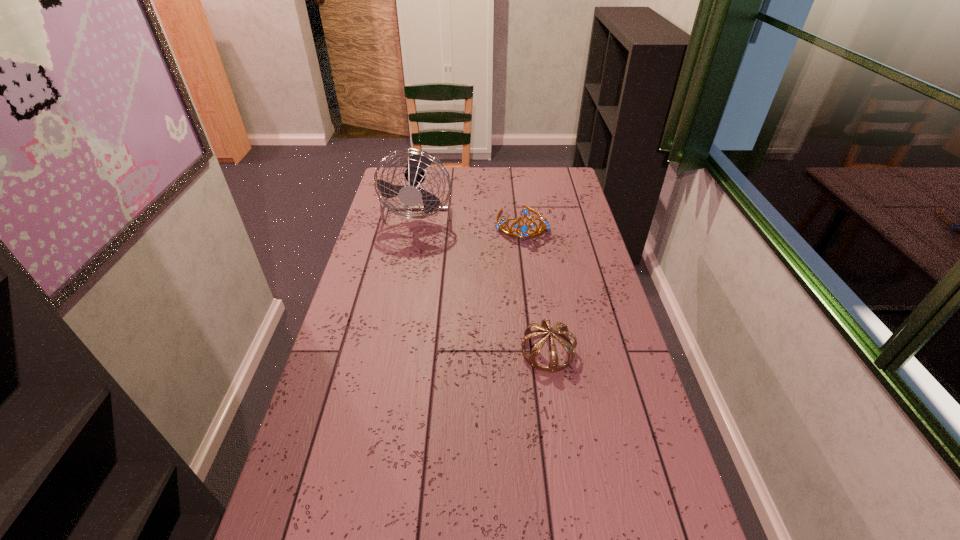
At what (x,y) coordinates should I click in order to perform the action: click on the leftmost object. Please return your answer as a coordinate pair (x, y). The image size is (960, 540). Looking at the image, I should click on (411, 195).

Image resolution: width=960 pixels, height=540 pixels. I want to click on the tallest object, so click(x=411, y=195).

Find the location of `the farther tiara`. the farther tiara is located at coordinates (523, 229).

At what (x,y) coordinates should I click in order to perform the action: click on the second tallest object. Please return your answer as a coordinate pair (x, y). This screenshot has height=540, width=960. Looking at the image, I should click on (523, 229).

Locate an element on the screen. The width and height of the screenshot is (960, 540). the shorter tiara is located at coordinates (545, 327).

This screenshot has height=540, width=960. Identify the location of the nearer tiara. (545, 327).

The image size is (960, 540). In order to click on vacant space located on the front-facing side of the fan in this screenshot , I will do `click(408, 269)`.

Where is `vacant space located on the front-facing side of the second shortest object`? Image resolution: width=960 pixels, height=540 pixels. vacant space located on the front-facing side of the second shortest object is located at coordinates (530, 285).

The image size is (960, 540). In order to click on vacant region located 0.360m on the front of the shortest object in this screenshot , I will do `click(571, 507)`.

This screenshot has height=540, width=960. Identify the location of object at the far edge. (411, 195).